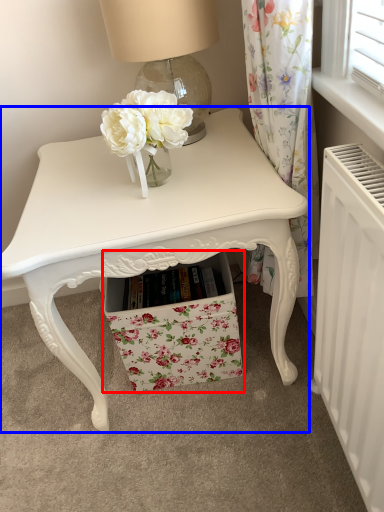
Question: Among these objects, which one is nearest to the camera, drawer (highlighted by a red box) or table (highlighted by a blue box)?

Choices:
 (A) drawer
 (B) table

Answer: (B)